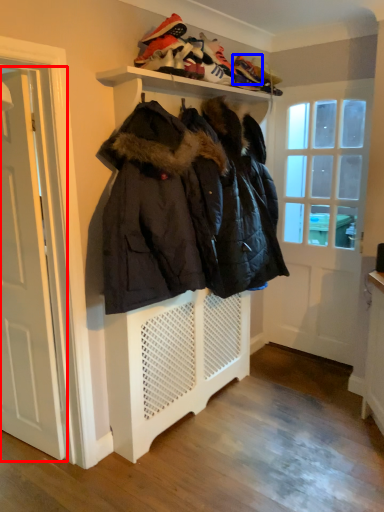
Question: Which of the following is the farthest to the observer, door (highlighted by a red box) or shoe (highlighted by a blue box)?

Choices:
 (A) door
 (B) shoe

Answer: (B)